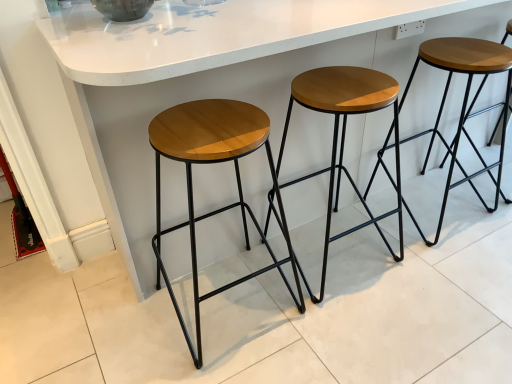
This screenshot has height=384, width=512. Find the location of `empty space that is ontop of wooden/matte stool at center, placed as the first stool when sorted from left to right`. empty space that is ontop of wooden/matte stool at center, placed as the first stool when sorted from left to right is located at coordinates (209, 126).